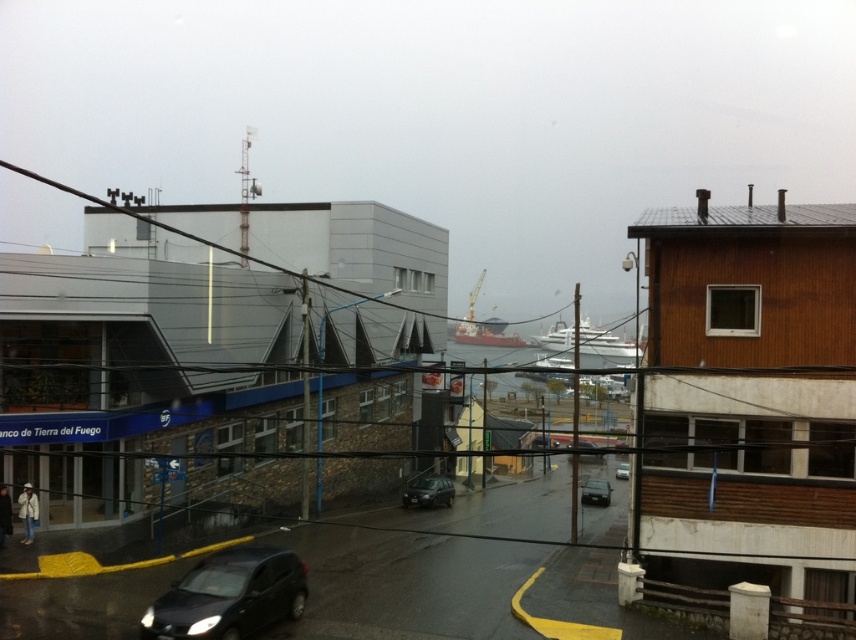
Who is positioned more to the right, matte black car at lower left or shiny black car at center?

Positioned to the right is shiny black car at center.

Who is more distant from viewer, (214, 568) or (447, 506)?

The point (447, 506) is behind.

You are a GUI agent. You are given a task and a screenshot of the screen. Output one action in this format:
    pyautogui.click(x=<x>, y=<y>)
    Task: Click on the matte black car at lower left
    
    Given the screenshot: What is the action you would take?
    click(229, 595)

Who is more distant from viewer, (589, 481) or (623, 464)?

Positioned behind is point (623, 464).

Who is lower down, shiny black sedan at center or matte black car at center?

shiny black sedan at center is lower down.

What do you see at coordinates (595, 492) in the screenshot? I see `shiny black sedan at center` at bounding box center [595, 492].

Find the location of a particular element. This screenshot has width=856, height=640. shiny black sedan at center is located at coordinates (595, 492).

Who is shorter, matte black car at lower left or shiny black sedan at center?

matte black car at lower left is shorter.

Does matte black car at lower left have a greater height compared to shiny black sedan at center?

No, matte black car at lower left is not taller than shiny black sedan at center.

The image size is (856, 640). What do you see at coordinates (229, 595) in the screenshot?
I see `matte black car at lower left` at bounding box center [229, 595].

Image resolution: width=856 pixels, height=640 pixels. In order to click on matte black car at lower left in this screenshot , I will do `click(229, 595)`.